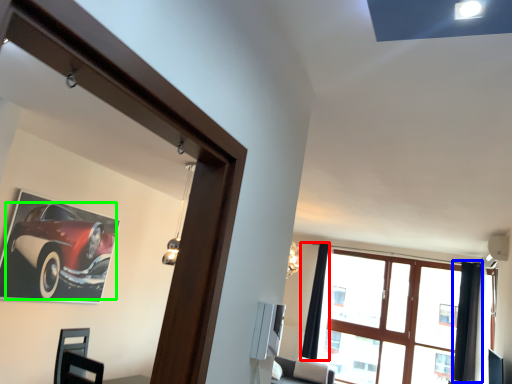
Question: Based on their relative distances, which object is nearer to curtain (highlighted by a red box)? Choose from curtain (highlighted by a blue box) and car (highlighted by a green box).

Choices:
 (A) curtain
 (B) car

Answer: (A)